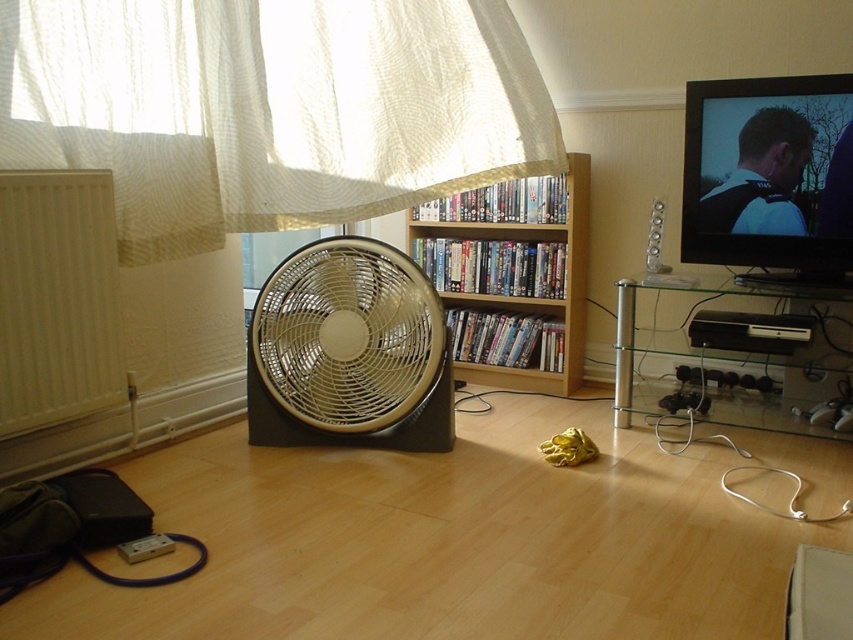
Question: Is white matte radiator at left smaller than black plastic speaker at right?

Choices:
 (A) yes
 (B) no

Answer: (B)

Question: Which object is the closest to the matte silver fan at center?

Choices:
 (A) black plastic speaker at right
 (B) white sheer curtain at upper left
 (C) wooden bookshelf at center

Answer: (B)

Question: Is matte silver fan at center wider than wooden bookshelf at center?

Choices:
 (A) yes
 (B) no

Answer: (B)

Question: Which object appears closest to the camera in this image?

Choices:
 (A) wooden bookshelf at center
 (B) matte silver fan at center

Answer: (B)

Question: Which point is closer to the camera?

Choices:
 (A) white matte radiator at left
 (B) matte silver fan at center
 (C) wooden bookshelf at center
 (D) black plastic speaker at right

Answer: (A)

Question: Can you confirm if white sheer curtain at upper left is bigger than matte silver fan at center?

Choices:
 (A) no
 (B) yes

Answer: (B)